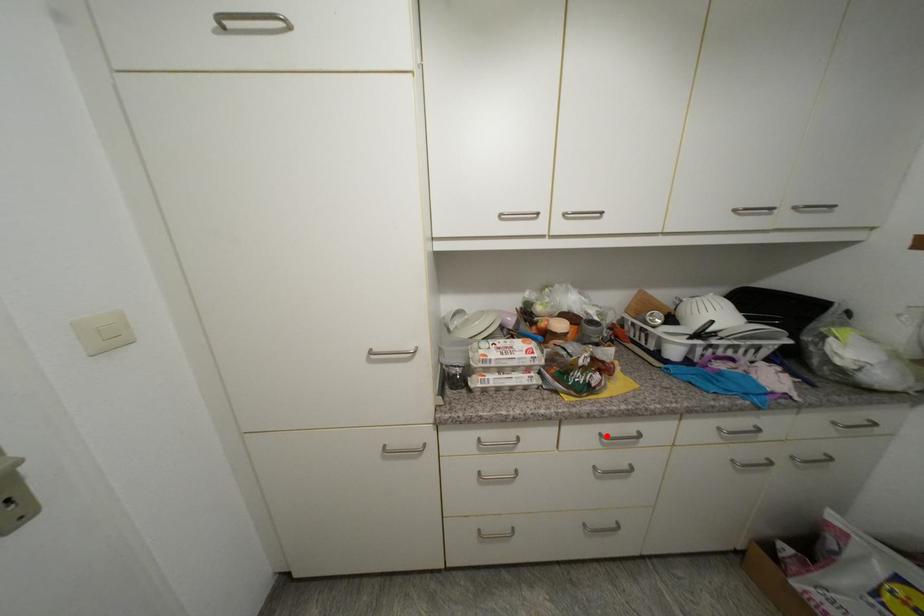
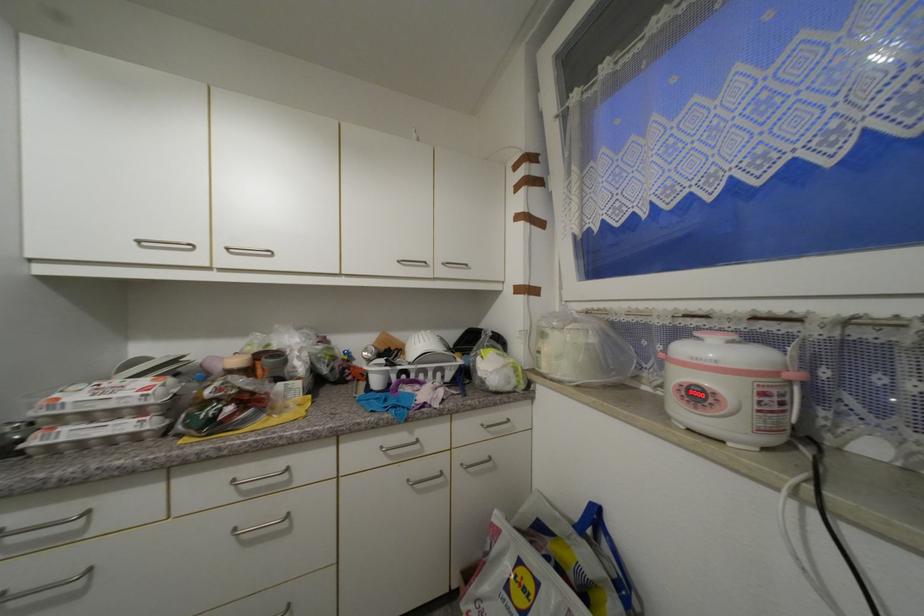
The point at the highlighted location is marked in the first image. Where is the corresponding point in the second image?

(238, 483)